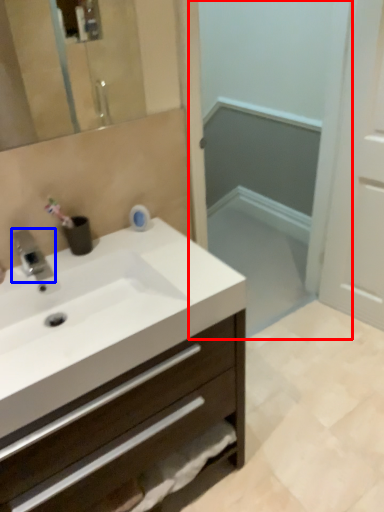
Question: Which object appears farthest to the camera in this image, screen door (highlighted by a red box) or tap (highlighted by a blue box)?

Choices:
 (A) screen door
 (B) tap

Answer: (A)